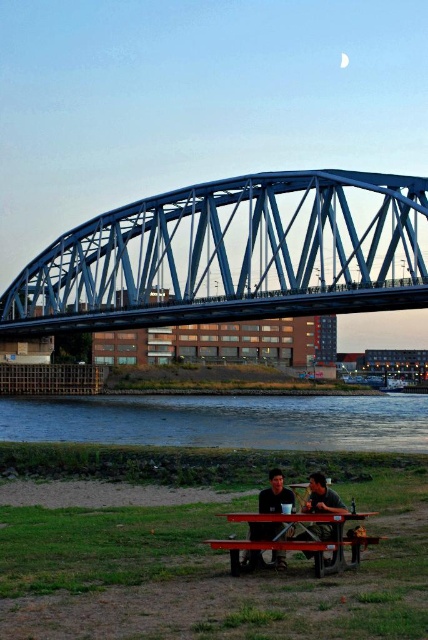
Is matte black shirt at center wider than matte black shirt at lower center?

No, matte black shirt at center is not wider than matte black shirt at lower center.

Is point (267, 490) more distant than point (296, 538)?

Yes, it is.

Measure the distance between matte black shirt at center and camera.

matte black shirt at center is 45.47 meters from camera.

Identify the location of matte black shirt at center. 275,493.

Between blue metallic bridge at upper center and red painted wood picnic table at lower center, which one is positioned higher?

blue metallic bridge at upper center is higher up.

Can you confirm if blue metallic bridge at upper center is bigger than red painted wood picnic table at lower center?

Yes.

The height and width of the screenshot is (640, 428). What are the coordinates of `blue metallic bridge at upper center` in the screenshot? It's located at (232, 256).

Find the location of a particular element. The height and width of the screenshot is (640, 428). blue metallic bridge at upper center is located at coordinates pyautogui.click(x=232, y=256).

Who is positioned more to the left, wooden picnic table at lower center or matte black shirt at lower center?

Positioned to the left is wooden picnic table at lower center.

Can you confirm if wooden picnic table at lower center is bigger than matte black shirt at lower center?

Correct, wooden picnic table at lower center is larger in size than matte black shirt at lower center.

This screenshot has width=428, height=640. Describe the element at coordinates (287, 531) in the screenshot. I see `wooden picnic table at lower center` at that location.

Locate an element on the screen. wooden picnic table at lower center is located at coordinates (287, 531).